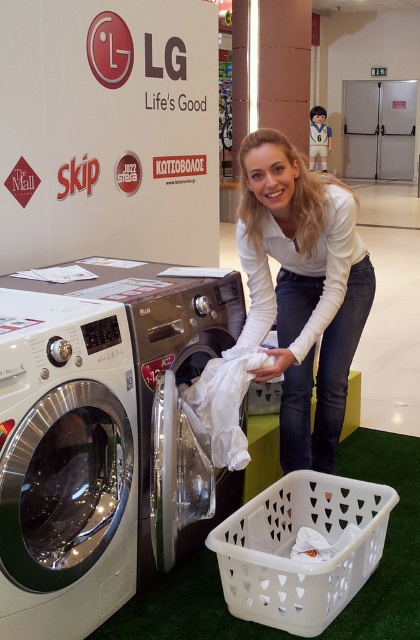
Image resolution: width=420 pixels, height=640 pixels. Identify the location of white matte shirt at center. (301, 289).

Between white matte shirt at center and white glossy washing machine at center, which one is positioned higher?

white matte shirt at center is higher up.

Locate an element on the screen. The width and height of the screenshot is (420, 640). white matte shirt at center is located at coordinates (301, 289).

Is point (73, 355) farther from viewer compared to point (239, 358)?

No.

Find the location of a particular element. This screenshot has height=640, width=420. white glossy washing machine at lower left is located at coordinates (65, 465).

Is point (65, 381) less distant than point (236, 348)?

Yes.

You are a GUI agent. You are given a task and a screenshot of the screen. Output one action in this format:
    pyautogui.click(x=<x>, y=<y>)
    Task: Click on the white glossy washing machine at lower left
    The image size is (420, 640).
    Given the screenshot: What is the action you would take?
    pyautogui.click(x=65, y=465)

Does point (267, 173) come farther from viewer compared to point (241, 390)?

Yes, it is.

Does white matte shirt at center appear under white fabric at lower center?

Actually, white matte shirt at center is above white fabric at lower center.

This screenshot has height=640, width=420. Describe the element at coordinates (301, 289) in the screenshot. I see `white matte shirt at center` at that location.

At what (x,y) coordinates should I click in order to perform the action: click on white matte shirt at center. Please return your answer as a coordinate pair (x, y). The height and width of the screenshot is (640, 420). Looking at the image, I should click on (301, 289).